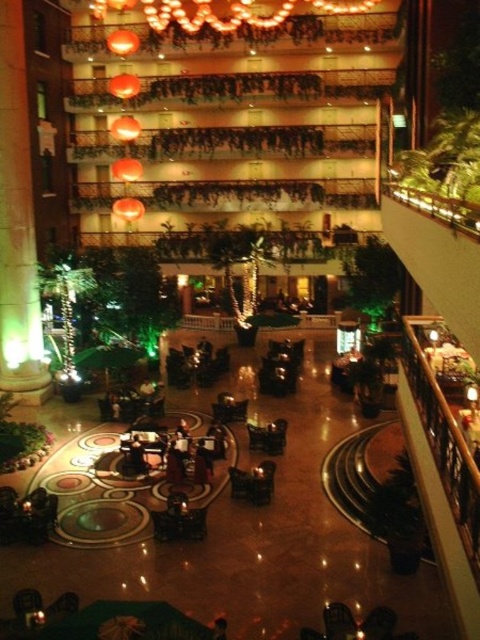
Is green marble pillar at left further to camera compared to illuminated glass chandelier at upper center?

No, it is not.

Does green marble pillar at left have a greater width compared to illuminated glass chandelier at upper center?

Incorrect, green marble pillar at left's width does not surpass illuminated glass chandelier at upper center's.

Between point (37, 316) and point (252, 3), which one is positioned in front?

Point (37, 316) is more forward.

Image resolution: width=480 pixels, height=640 pixels. I want to click on green marble pillar at left, so click(x=17, y=225).